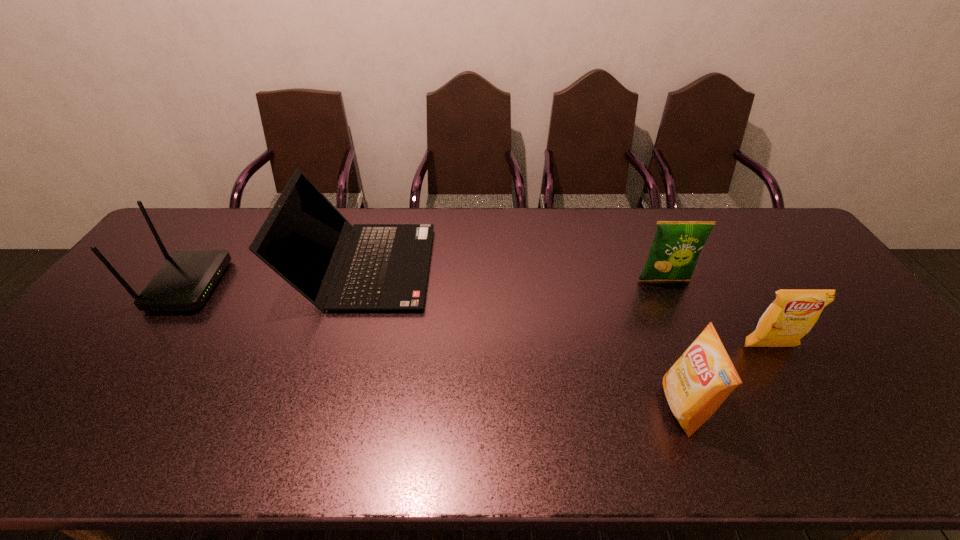
The width and height of the screenshot is (960, 540). Identify the location of the second object from left to right. (336, 266).

Identify the location of router. (183, 283).

You are a GUI agent. You are given a task and a screenshot of the screen. Output one action in this format:
    pyautogui.click(x=<x>, y=<y>)
    Task: Click on the farthest crisp (potato chip)
    
    Given the screenshot: What is the action you would take?
    pyautogui.click(x=676, y=247)

This screenshot has width=960, height=540. Find the location of `the nearest crisp (potato chip)`. the nearest crisp (potato chip) is located at coordinates (703, 377).

Find the location of a particular element. This screenshot has height=540, width=960. the second farthest crisp (potato chip) is located at coordinates (793, 313).

I want to click on the rightmost crisp (potato chip), so (x=793, y=313).

I want to click on vacant space located on the screen of the fourth object from right to left, so click(496, 267).

Find the location of `free spot located on the front-facing side of the leftmost object`. free spot located on the front-facing side of the leftmost object is located at coordinates (270, 285).

The height and width of the screenshot is (540, 960). Identify the location of vacant region located on the front-facing side of the farthest crisp (potato chip). (686, 332).

Locate an element on the screen. free location located 0.180m on the front-facing side of the nearest crisp (potato chip) is located at coordinates (586, 407).